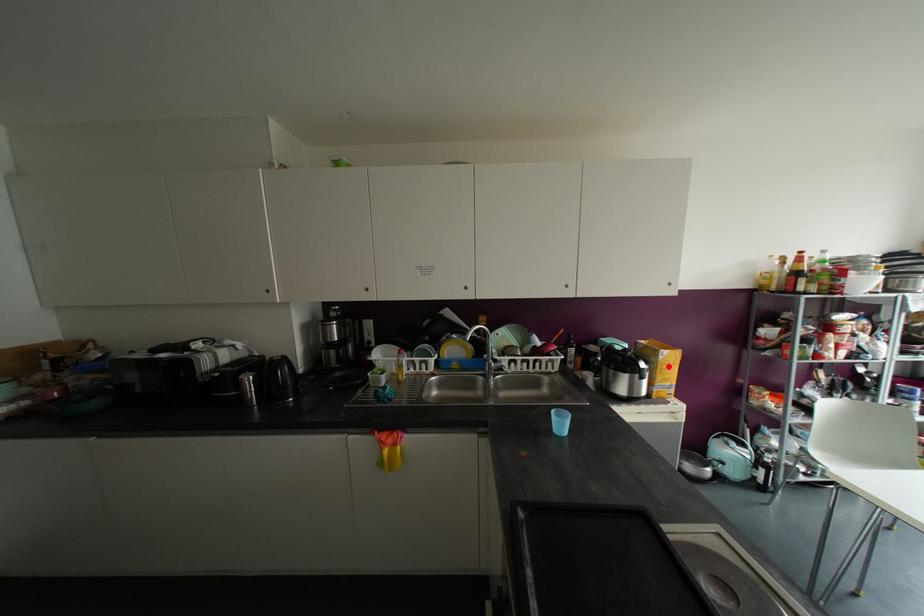
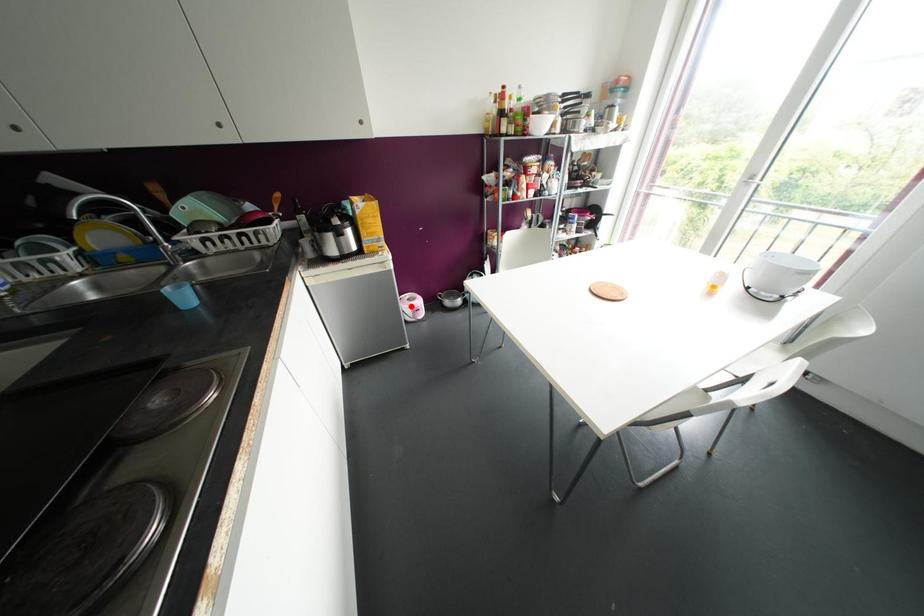
I am providing you with two images of the same scene from different viewpoints. A red point is marked on the first image and another point is marked on the second image. Is the marked point in image1 the same physical position as the marked point in image2?

No